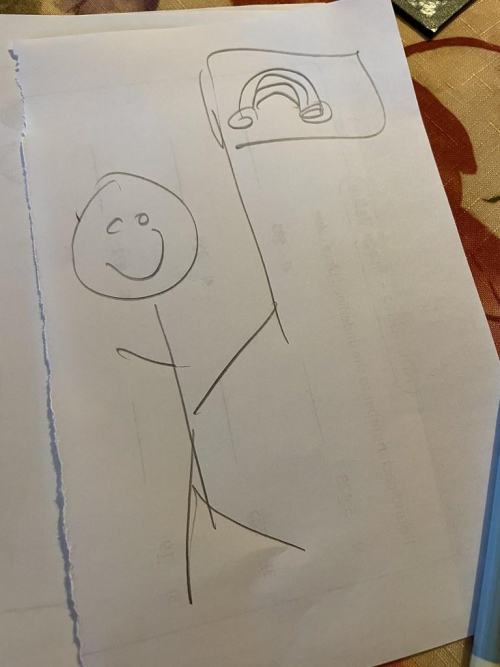
At what (x,y) coordinates should I click in order to perform the action: click on rug background. Please return your answer as a coordinate pair (x, y). This screenshot has height=667, width=500. Looking at the image, I should click on (440, 47), (476, 115), (476, 209), (433, 661).